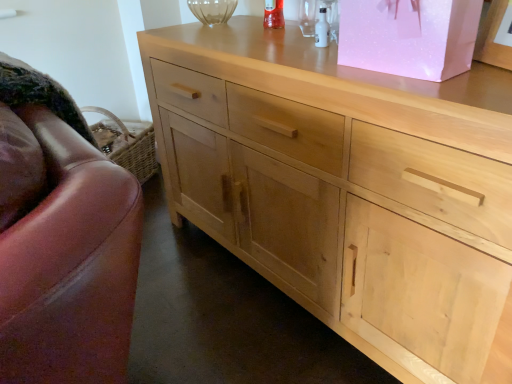
Question: From the image's perspective, is natural wood cabinet at center on pink paper bag at upper right?

Choices:
 (A) no
 (B) yes

Answer: (A)

Question: Is natural wood cabinet at center bigger than pink paper bag at upper right?

Choices:
 (A) yes
 (B) no

Answer: (A)

Question: Are natural wood cabinet at center and pink paper bag at upper right beside each other?

Choices:
 (A) yes
 (B) no

Answer: (B)

Question: Considering the relative positions of natural wood cabinet at center and pink paper bag at upper right in the image provided, is natural wood cabinet at center to the right of pink paper bag at upper right from the viewer's perspective?

Choices:
 (A) yes
 (B) no

Answer: (B)

Question: Is natural wood cabinet at center at the left side of pink paper bag at upper right?

Choices:
 (A) yes
 (B) no

Answer: (A)

Question: Does natural wood cabinet at center come behind pink paper bag at upper right?

Choices:
 (A) yes
 (B) no

Answer: (B)

Question: Is natural wood cabinet at center not inside leather swivel chair at left?

Choices:
 (A) yes
 (B) no

Answer: (A)

Question: Does natural wood cabinet at center have a greater height compared to leather swivel chair at left?

Choices:
 (A) yes
 (B) no

Answer: (A)

Question: Is natural wood cabinet at center oriented towards leather swivel chair at left?

Choices:
 (A) yes
 (B) no

Answer: (A)

Question: Is natural wood cabinet at center bigger than leather swivel chair at left?

Choices:
 (A) yes
 (B) no

Answer: (A)

Question: Is natural wood cabinet at center thinner than leather swivel chair at left?

Choices:
 (A) yes
 (B) no

Answer: (B)

Question: Considering the relative sizes of natural wood cabinet at center and leather swivel chair at left in the image provided, is natural wood cabinet at center smaller than leather swivel chair at left?

Choices:
 (A) yes
 (B) no

Answer: (B)

Question: Is leather swivel chair at left to the left of pink paper bag at upper right from the viewer's perspective?

Choices:
 (A) yes
 (B) no

Answer: (A)